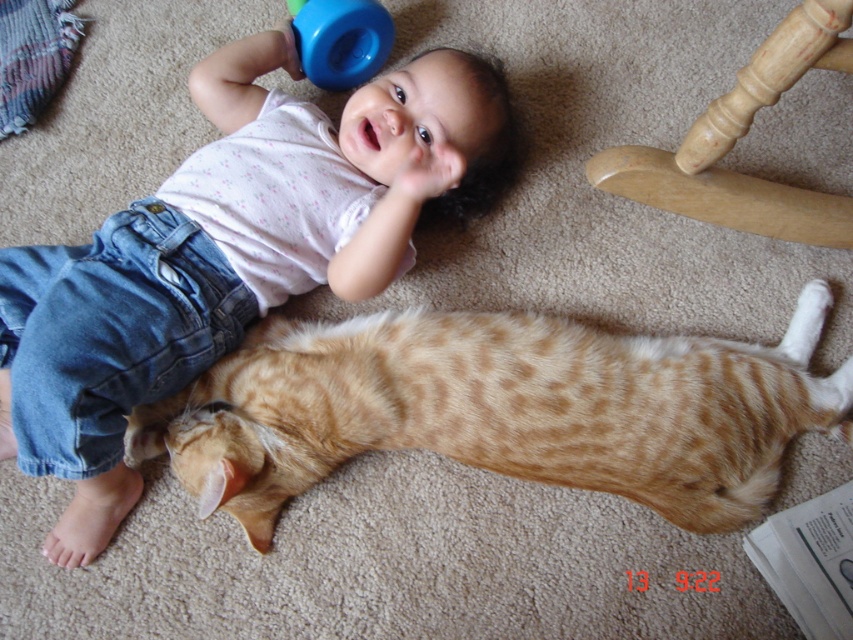
You are a parent who wants to hand the baby a pacifier. The pacifier is on the floor at point (106, 474). The baby is holding a blue sippy cup. Can the baby reach the pacifier without letting go of the sippy cup?

The pacifier is 1.14 meters away from the baby. Since the baby is holding a blue sippy cup with their left hand, they would need to use their right hand to reach for the pacifier. However, the distance of 1.14 meters is too far for a baby to reach while holding the sippy cup in one hand. Therefore, the baby cannot reach the pacifier without letting go of the sippy cup.

You are a photographer taking a picture of the baby and the cat. You notice the matte white shirt at upper center and the blue rubber sippy cup at upper center in the frame. Which object should you adjust to ensure the baby is centered in the photo?

You should adjust the blue rubber sippy cup at upper center because the matte white shirt at upper center is positioned on the left side of it, so moving the sippy cup to the right would help center the baby.

In the scene shown: You are a parent trying to choose between placing a small decorative pillow or a large floor lamp in the living room. The light wood rocking chair at upper right and the blue rubber sippy cup at upper center are already present. Which object should you avoid placing near to prevent blocking the view of the baby and cat? Explain your reasoning.

You should avoid placing the large floor lamp near the light wood rocking chair at upper right because it is bigger and could block the view of the baby and cat. The blue rubber sippy cup at upper center is smaller and less likely to obstruct the view.